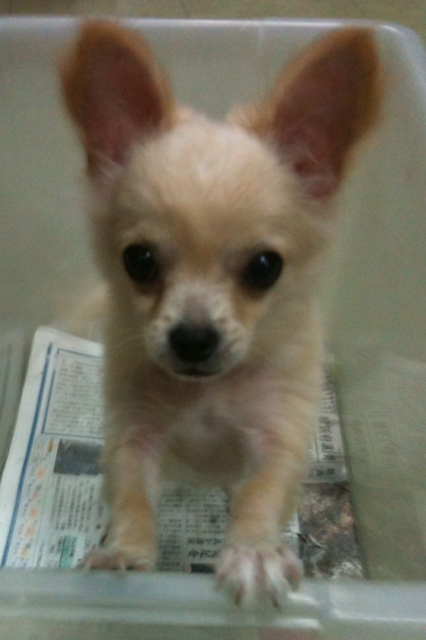
At what (x,y) coordinates should I click in order to perform the action: click on plastic bin. Please return your answer as a coordinate pair (x, y). Looking at the image, I should click on (383, 316), (184, 596), (212, 57), (49, 265).